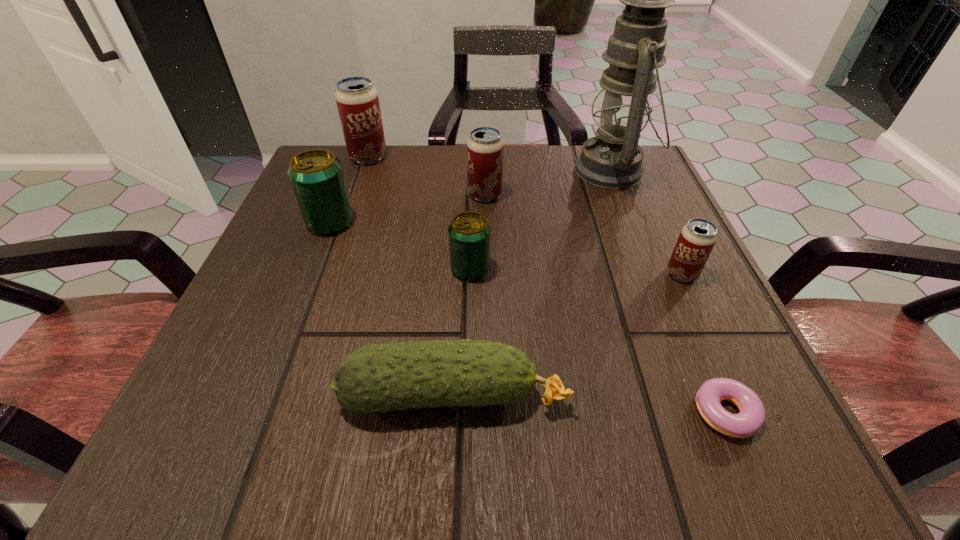
Image resolution: width=960 pixels, height=540 pixels. What are the coordinates of `free spot located 0.230m on the front of the nearer green beer can` in the screenshot? It's located at (468, 414).

The height and width of the screenshot is (540, 960). What are the coordinates of `vacant region located at the blossom end of the green cucumber` in the screenshot? It's located at click(659, 395).

I want to click on blank space located 0.390m on the back of the purple doughnut, so click(637, 210).

Image resolution: width=960 pixels, height=540 pixels. Identify the location of oil lamp located at the far edge. (613, 159).

Image resolution: width=960 pixels, height=540 pixels. I want to click on cucumber that is positioned at the near edge, so click(x=390, y=376).

Image resolution: width=960 pixels, height=540 pixels. What are the coordinates of `doughnut at the near edge` in the screenshot? It's located at (751, 417).

Identify the location of oil lamp that is at the right edge. (613, 159).

Where is `beer can that is at the right edge`? beer can that is at the right edge is located at coordinates (697, 238).

At what (x,y) coordinates should I click in order to perform the action: click on doughnut positioned at the right edge. Please return your answer as a coordinate pair (x, y). Looking at the image, I should click on (751, 417).

Where is `object that is at the far left corner`? object that is at the far left corner is located at coordinates (357, 100).